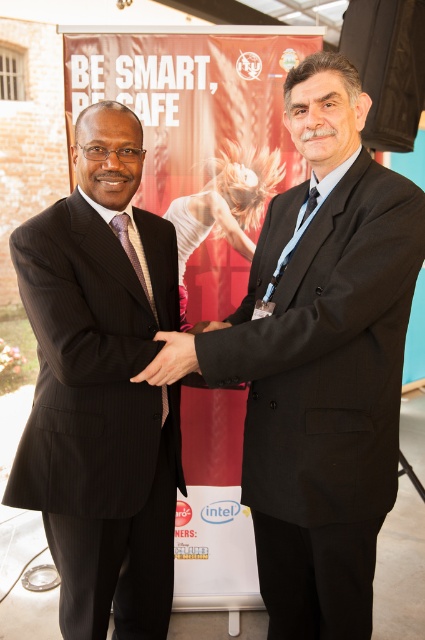
Question: Does matte red poster at center have a larger size compared to matte black hand at center?

Choices:
 (A) no
 (B) yes

Answer: (B)

Question: Considering the real-world distances, which object is closest to the matte black hand at center?

Choices:
 (A) black matte hand at center
 (B) matte red poster at center
 (C) black pinstripe suit at left

Answer: (A)

Question: Does black pinstripe suit at left have a greater width compared to matte black hand at center?

Choices:
 (A) yes
 (B) no

Answer: (A)

Question: Among these points, which one is nearest to the camera?

Choices:
 (A) (204, 330)
 (B) (192, 348)
 (C) (121, 184)

Answer: (B)

Question: Does black matte suit at center come in front of black pinstripe suit at left?

Choices:
 (A) no
 (B) yes

Answer: (B)

Question: Which point is farther from the camera taking this photo?

Choices:
 (A) (223, 224)
 (B) (206, 328)

Answer: (A)